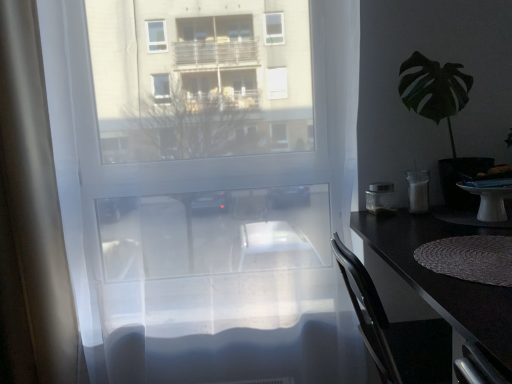
Question: Is green leafy plant at right outside white opaque glass at right, which is counted as the second appliance, starting from the left?

Choices:
 (A) yes
 (B) no

Answer: (A)

Question: Considering the relative positions of green leafy plant at right and white opaque glass at right, which is counted as the second appliance, starting from the left, in the image provided, is green leafy plant at right to the left of white opaque glass at right, which is counted as the second appliance, starting from the left, from the viewer's perspective?

Choices:
 (A) no
 (B) yes

Answer: (A)

Question: From a real-world perspective, is green leafy plant at right positioned over white opaque glass at right, placed as the first appliance when sorted from right to left, based on gravity?

Choices:
 (A) yes
 (B) no

Answer: (A)

Question: Considering the relative sizes of green leafy plant at right and white opaque glass at right, which is counted as the second appliance, starting from the left, in the image provided, is green leafy plant at right wider than white opaque glass at right, which is counted as the second appliance, starting from the left,?

Choices:
 (A) yes
 (B) no

Answer: (A)

Question: Is green leafy plant at right not near white opaque glass at right, placed as the first appliance when sorted from right to left?

Choices:
 (A) no
 (B) yes

Answer: (A)

Question: Can you confirm if green leafy plant at right is shorter than white opaque glass at right, which is counted as the second appliance, starting from the left?

Choices:
 (A) no
 (B) yes

Answer: (A)

Question: Considering the relative positions of green leafy plant at right and metallic silver container at right, marked as the 1th appliance in a left-to-right arrangement, in the image provided, is green leafy plant at right to the right of metallic silver container at right, marked as the 1th appliance in a left-to-right arrangement, from the viewer's perspective?

Choices:
 (A) yes
 (B) no

Answer: (A)

Question: Is green leafy plant at right positioned with its back to metallic silver container at right, which is counted as the 2th appliance, starting from the right?

Choices:
 (A) yes
 (B) no

Answer: (B)

Question: Considering the relative positions of green leafy plant at right and metallic silver container at right, which is counted as the 2th appliance, starting from the right, in the image provided, is green leafy plant at right behind metallic silver container at right, which is counted as the 2th appliance, starting from the right,?

Choices:
 (A) no
 (B) yes

Answer: (A)

Question: Is green leafy plant at right wider than metallic silver container at right, marked as the 1th appliance in a left-to-right arrangement?

Choices:
 (A) no
 (B) yes

Answer: (B)

Question: Does green leafy plant at right have a lesser height compared to metallic silver container at right, marked as the 1th appliance in a left-to-right arrangement?

Choices:
 (A) no
 (B) yes

Answer: (A)

Question: Does green leafy plant at right have a greater height compared to metallic silver container at right, which is counted as the 2th appliance, starting from the right?

Choices:
 (A) yes
 (B) no

Answer: (A)

Question: Could green leafy plant at right be considered to be inside black glossy desk at right?

Choices:
 (A) yes
 (B) no

Answer: (B)